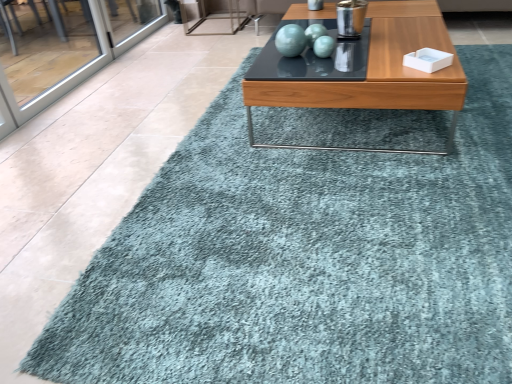
Question: Which is correct: matte turquoise sphere at center is inside wooden glossy coffee table at center, or outside of it?

Choices:
 (A) outside
 (B) inside

Answer: (A)

Question: From the image's perspective, is matte turquoise sphere at center above or below wooden glossy coffee table at center?

Choices:
 (A) below
 (B) above

Answer: (B)

Question: In terms of height, does matte turquoise sphere at center look taller or shorter compared to wooden glossy coffee table at center?

Choices:
 (A) tall
 (B) short

Answer: (B)

Question: In terms of height, does wooden glossy coffee table at center look taller or shorter compared to matte turquoise sphere at center?

Choices:
 (A) short
 (B) tall

Answer: (B)

Question: Based on their sizes in the image, would you say wooden glossy coffee table at center is bigger or smaller than matte turquoise sphere at center?

Choices:
 (A) big
 (B) small

Answer: (A)

Question: From the image's perspective, is wooden glossy coffee table at center located above or below matte turquoise sphere at center?

Choices:
 (A) below
 (B) above

Answer: (A)

Question: Is wooden glossy coffee table at center situated inside matte turquoise sphere at center or outside?

Choices:
 (A) inside
 (B) outside

Answer: (B)